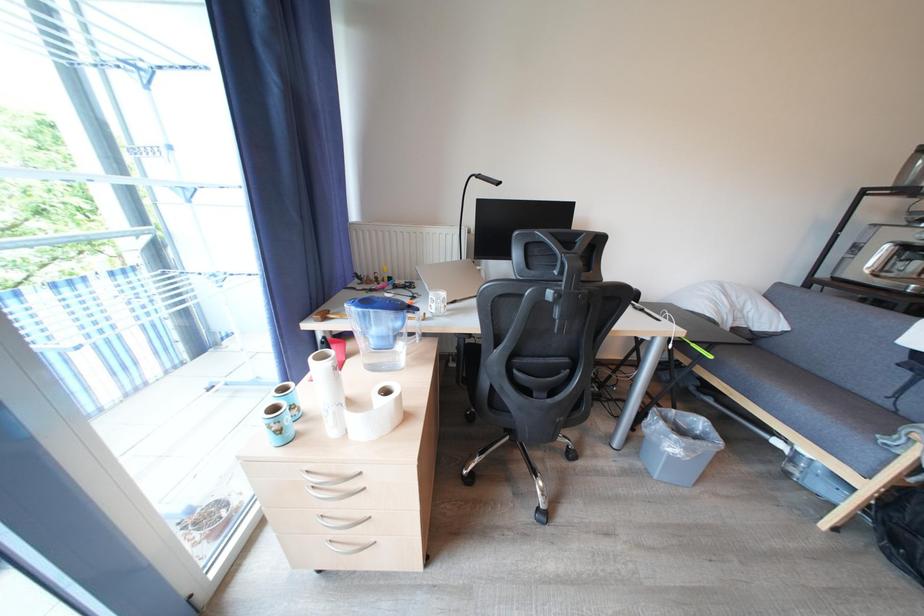
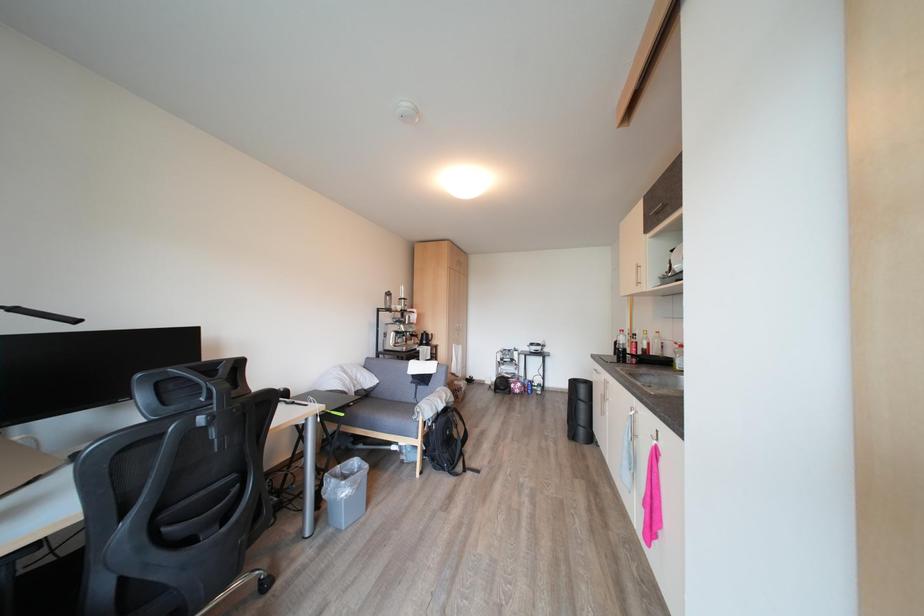
Question: The camera is either moving clockwise (left) or counter-clockwise (right) around the object. The first image is from the beginning of the video and the second image is from the end. Is the camera moving left or right when shooting the video?

Choices:
 (A) Left
 (B) Right

Answer: (A)